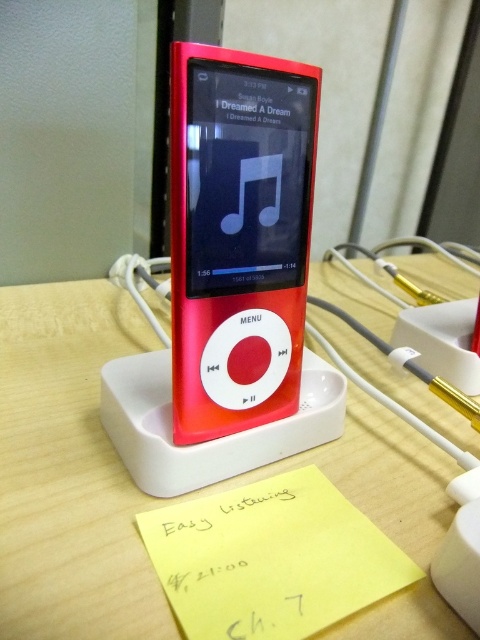
You are organizing your desk and need to place a new item on the surface. You have a matte plastic table at center and a yellow paper at lower center. Which object should you place the item on if you want it closer to you?

You should place the item on the yellow paper at lower center because it is closer to you than the matte plastic table at center.

You are organizing your desk and need to place a new item between the matte plastic ipod at center and the yellow paper at lower center. Based on their current positions, where should you place the new item to ensure it is between them?

Since the matte plastic ipod at center is to the left of the yellow paper at lower center, you should place the new item between them to the right of the matte plastic ipod at center and to the left of the yellow paper at lower center.